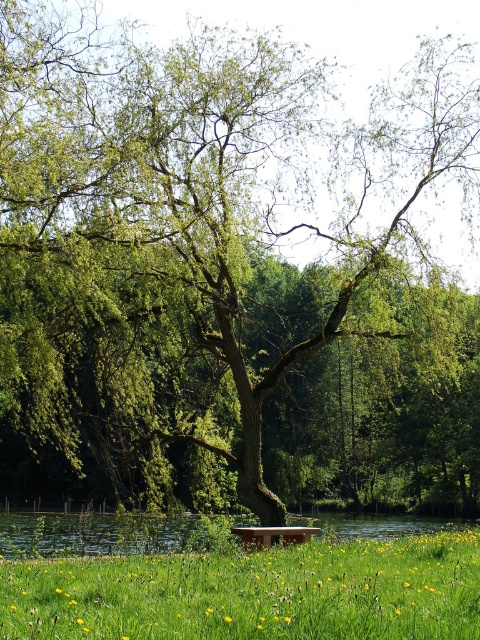
Looking at this image, you are standing in a peaceful garden with a large weeping willow tree. You see the green grassy area at lower center where you want to place a picnic blanket. If your picnic blanket is 2 meters wide, will there be enough space between you and the green grassy at lower center to spread it out?

The distance between you and the green grassy at lower center is 4.77 meters. Since the picnic blanket is only 2 meters wide, there is sufficient space to spread it out comfortably.

You are planning to sit on the wooden bench at center. Based on the scene, will your feet be near the green grassy river at lower center?

Yes, because the green grassy river at lower center is below the wooden bench at center, so sitting on the bench would place your feet near the river.